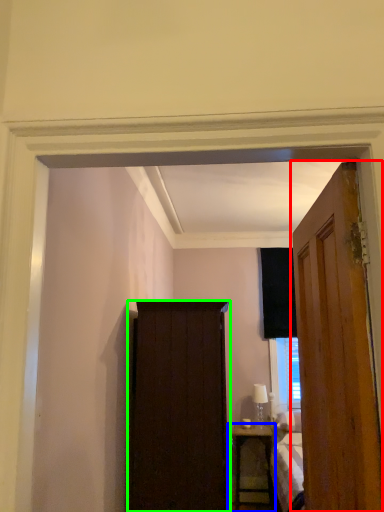
Question: Which object is positioned farthest from door (highlighted by a red box)? Select from nightstand (highlighted by a blue box) and screen door (highlighted by a green box).

Choices:
 (A) nightstand
 (B) screen door

Answer: (A)